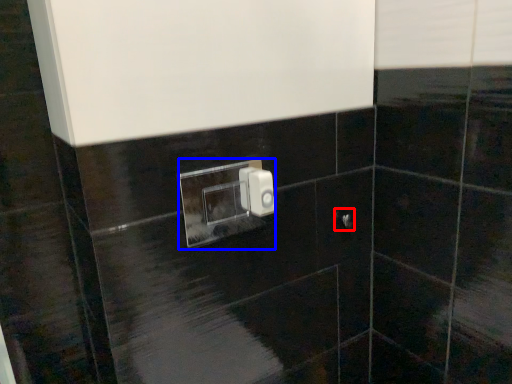
Question: Which of the following is the farthest to the observer, door handle (highlighted by a red box) or light switch (highlighted by a blue box)?

Choices:
 (A) door handle
 (B) light switch

Answer: (A)